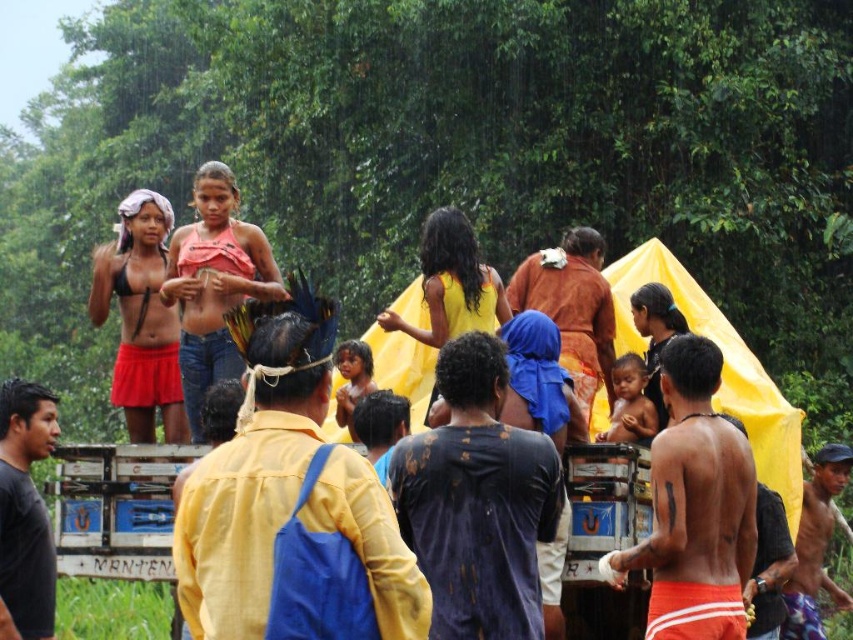
Does dark blue fabric shirt at center have a greater height compared to dark skin child at center?

Yes, dark blue fabric shirt at center is taller than dark skin child at center.

Is point (543, 515) more distant than point (364, 374)?

No, it is in front of (364, 374).

This screenshot has height=640, width=853. What are the coordinates of `dark blue fabric shirt at center` in the screenshot? It's located at (477, 500).

Who is positioned more to the right, shiny metallic bracelet at lower right or dark skin child at center?

From the viewer's perspective, shiny metallic bracelet at lower right appears more on the right side.

Does shiny metallic bracelet at lower right have a lesser width compared to dark skin child at center?

No, shiny metallic bracelet at lower right is not thinner than dark skin child at center.

Does point (802, 620) lie behind point (370, 376)?

No, (802, 620) is in front of (370, 376).

The image size is (853, 640). I want to click on shiny metallic bracelet at lower right, so click(x=815, y=545).

Who is taller, shiny orange shorts at center-right or black matte shirt at left?

shiny orange shorts at center-right

Is point (666, 364) closer to viewer compared to point (22, 564)?

No, (666, 364) is further to viewer.

Is point (657, 627) positioned after point (32, 516)?

That is True.

The image size is (853, 640). In order to click on shiny orange shorts at center-right in this screenshot , I will do tap(694, 508).